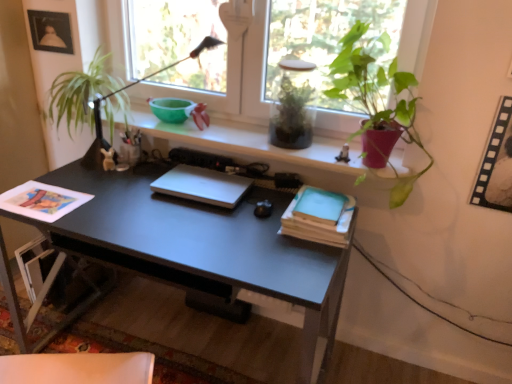
At what (x,y) coordinates should I click in order to perform the action: click on free spot below black matte desk at center (from a real-world perspective). Please return your answer as a coordinate pair (x, y). This screenshot has width=512, height=384. Looking at the image, I should click on (179, 343).